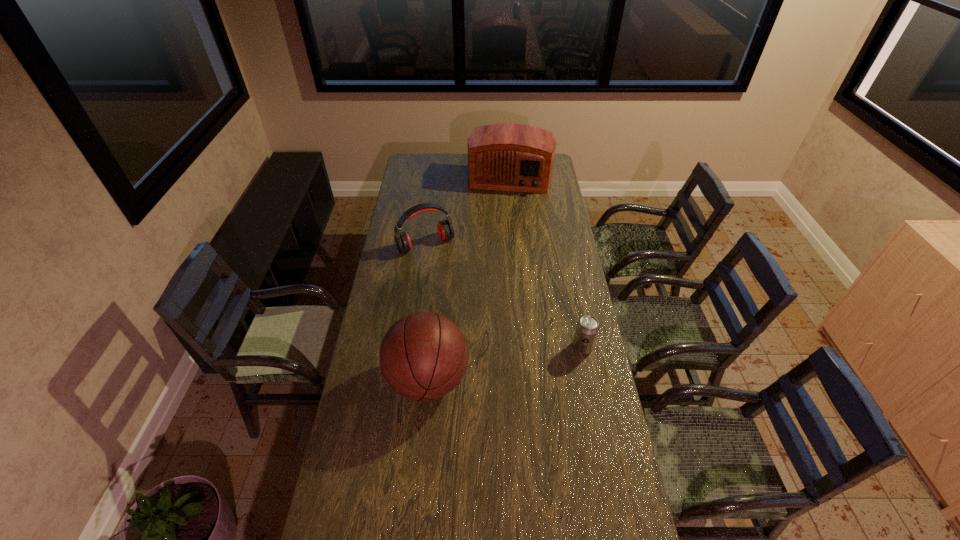
Identify the location of basketball. Image resolution: width=960 pixels, height=540 pixels. (423, 356).

Where is `the shortest object`? The width and height of the screenshot is (960, 540). the shortest object is located at coordinates (587, 328).

You are a GUI agent. You are given a task and a screenshot of the screen. Output one action in this format:
    pyautogui.click(x=<x>, y=<y>)
    Task: Click on the farthest object
    This screenshot has height=540, width=960.
    Given the screenshot: What is the action you would take?
    pyautogui.click(x=515, y=157)

I want to click on the second shortest object, so click(445, 229).

At what (x,y) coordinates should I click in order to perform the action: click on the second farthest object. Please return your answer as a coordinate pair (x, y). Looking at the image, I should click on (445, 229).

You are a GUI agent. You are given a task and a screenshot of the screen. Output one action in this format:
    pyautogui.click(x=<x>, y=<y>)
    Task: Click on the vacant space located on the right of the basketball
    Image resolution: width=960 pixels, height=540 pixels.
    Given the screenshot: What is the action you would take?
    [554, 380]

Find the location of `vacant space located 0.190m on the back of the shortest object`. vacant space located 0.190m on the back of the shortest object is located at coordinates (574, 303).

Find the location of `free space located on the front-facing side of the radio receiver`. free space located on the front-facing side of the radio receiver is located at coordinates (505, 205).

At what (x,y) coordinates should I click in order to perform the action: click on vacant space located 0.250m on the front-facing side of the radio receiver. Please return your answer as a coordinate pair (x, y). The height and width of the screenshot is (540, 960). Looking at the image, I should click on (502, 224).

The image size is (960, 540). Find the location of `vacant space located 0.130m on the front-facing side of the radio receiver`. vacant space located 0.130m on the front-facing side of the radio receiver is located at coordinates (504, 210).